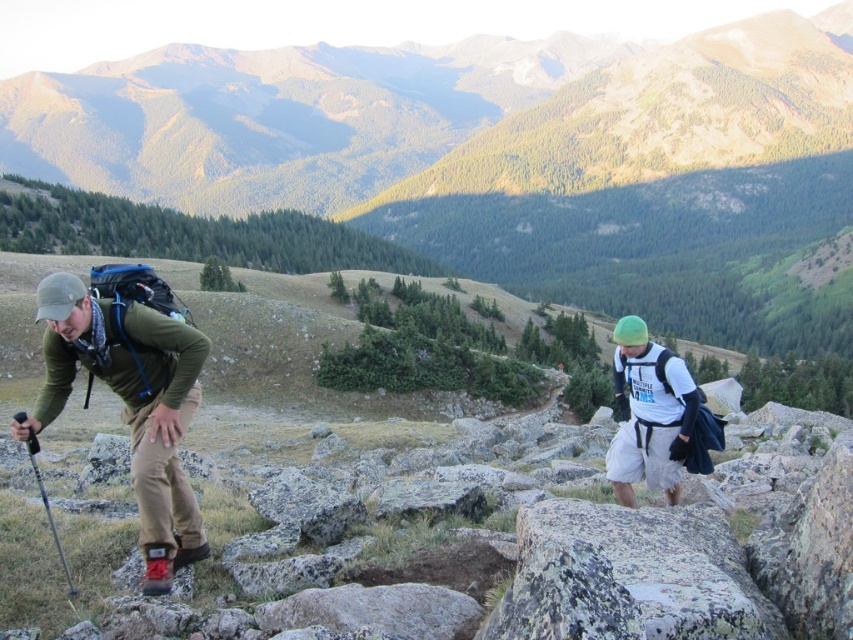
You are a hiker planning to place a GPS marker at the midpoint between the matte green jacket at left and the nearest tree in the scene. What coordinates should you use?

The coordinates for the midpoint between the matte green jacket at left and the nearest tree in the scene would be halfway between the jacket at point (131,403) and the tree.

Consider the image. You are a hiker planning to walk from the matte green jacket at left to the green grassy mountain at upper center. Which direction should you head to reach the mountain?

You should head upwards from the matte green jacket at left to reach the green grassy mountain at upper center since it is positioned over the jacket.